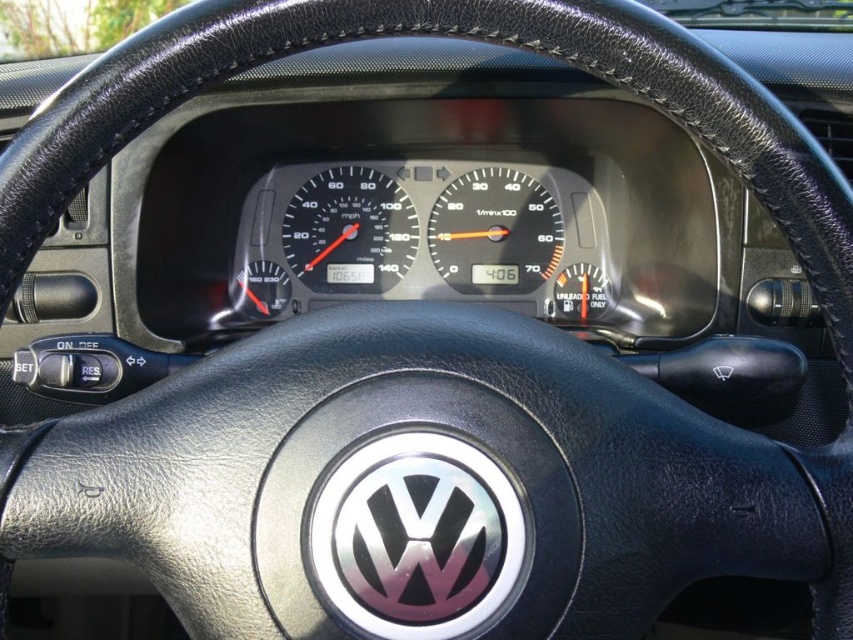
You are a mechanic working on a car dashboard. You need to install a new speedometer. The space available is 6 inches wide. Can the black glass speedometer at center and the matte black speedometer at center both fit side by side in this space?

The black glass speedometer at center and the matte black speedometer at center are 5.82 inches apart, so they can fit side by side in the 6 inch space since the total width required is less than the available space.